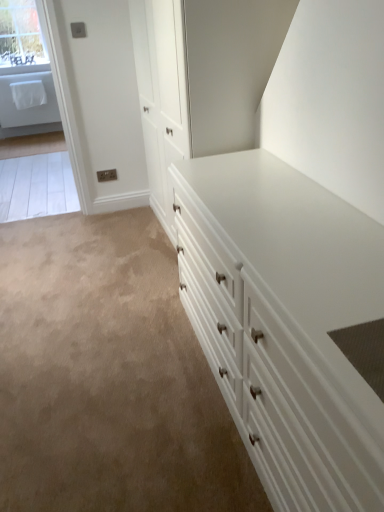
What do you see at coordinates (285, 322) in the screenshot? The width and height of the screenshot is (384, 512). I see `white glossy chest of drawers at center` at bounding box center [285, 322].

Locate an element on the screen. The height and width of the screenshot is (512, 384). white glossy chest of drawers at center is located at coordinates (285, 322).

From the picture: In order to face clear glass window at upper left, should I rotate leftwards or rightwards?

A 22.672 degree turn to the left will do.

Image resolution: width=384 pixels, height=512 pixels. What do you see at coordinates (21, 35) in the screenshot?
I see `clear glass window at upper left` at bounding box center [21, 35].

This screenshot has width=384, height=512. I want to click on clear glass window at upper left, so click(21, 35).

Identify the location of white glossy chest of drawers at center. (285, 322).

Which is more to the left, white glossy chest of drawers at center or clear glass window at upper left?

clear glass window at upper left.

Does white glossy chest of drawers at center lie behind clear glass window at upper left?

No.

Does point (299, 364) appear closer or farther from the camera than point (29, 17)?

Point (299, 364) is positioned closer to the camera compared to point (29, 17).

From the image's perspective, would you say white glossy chest of drawers at center is shown under clear glass window at upper left?

Yes, from the image's perspective, white glossy chest of drawers at center is beneath clear glass window at upper left.

From a real-world perspective, is white glossy chest of drawers at center physically below clear glass window at upper left?

Yes.

Between white glossy chest of drawers at center and clear glass window at upper left, which one has larger width?

white glossy chest of drawers at center is wider.

Who is taller, white glossy chest of drawers at center or clear glass window at upper left?

white glossy chest of drawers at center.

Who is bigger, white glossy chest of drawers at center or clear glass window at upper left?

white glossy chest of drawers at center is bigger.

Is clear glass window at upper left inside white glossy chest of drawers at center?

No, clear glass window at upper left is not a part of white glossy chest of drawers at center.

Is white glossy chest of drawers at center with clear glass window at upper left?

No, white glossy chest of drawers at center is not in contact with clear glass window at upper left.

Is white glossy chest of drawers at center turned away from clear glass window at upper left?

No, white glossy chest of drawers at center is not facing the opposite direction of clear glass window at upper left.

What's the angular difference between white glossy chest of drawers at center and clear glass window at upper left's facing directions?

white glossy chest of drawers at center and clear glass window at upper left are facing 89.9 degrees away from each other.

Find the location of a particular element. This screenshot has width=384, height=512. chest of drawers on the right of the clear glass window at upper left is located at coordinates (285, 322).

Does clear glass window at upper left appear on the right side of white glossy chest of drawers at center?

No, clear glass window at upper left is not to the right of white glossy chest of drawers at center.

Is the position of clear glass window at upper left less distant than that of white glossy chest of drawers at center?

No, the depth of clear glass window at upper left is greater than that of white glossy chest of drawers at center.

Considering the positions of point (32, 59) and point (325, 196), is point (32, 59) closer or farther from the camera than point (325, 196)?

Point (32, 59) is positioned farther from the camera compared to point (325, 196).

From the image's perspective, who appears lower, clear glass window at upper left or white glossy chest of drawers at center?

white glossy chest of drawers at center, from the image's perspective.

From a real-world perspective, is clear glass window at upper left located higher than white glossy chest of drawers at center?

Yes, from a real-world perspective, clear glass window at upper left is above white glossy chest of drawers at center.

Does clear glass window at upper left have a lesser width compared to white glossy chest of drawers at center?

Yes.

Who is taller, clear glass window at upper left or white glossy chest of drawers at center?

white glossy chest of drawers at center is taller.

From the picture: Who is bigger, clear glass window at upper left or white glossy chest of drawers at center?

Bigger between the two is white glossy chest of drawers at center.

Would you say clear glass window at upper left is outside white glossy chest of drawers at center?

That's correct, clear glass window at upper left is outside of white glossy chest of drawers at center.

Is clear glass window at upper left next to white glossy chest of drawers at center and touching it?

No, clear glass window at upper left is not next to white glossy chest of drawers at center.

Is clear glass window at upper left oriented away from white glossy chest of drawers at center?

No, clear glass window at upper left is not facing away from white glossy chest of drawers at center.

How different are the orientations of clear glass window at upper left and white glossy chest of drawers at center in degrees?

The facing directions of clear glass window at upper left and white glossy chest of drawers at center are 89.9 degrees apart.

Measure the distance between clear glass window at upper left and white glossy chest of drawers at center.

clear glass window at upper left and white glossy chest of drawers at center are 5.16 meters apart from each other.

Locate an element on the screen. The image size is (384, 512). chest of drawers on the right of clear glass window at upper left is located at coordinates (285, 322).

This screenshot has width=384, height=512. Find the location of `window that is behind the white glossy chest of drawers at center`. window that is behind the white glossy chest of drawers at center is located at coordinates (21, 35).

Identify the location of window above the white glossy chest of drawers at center (from the image's perspective). (21, 35).